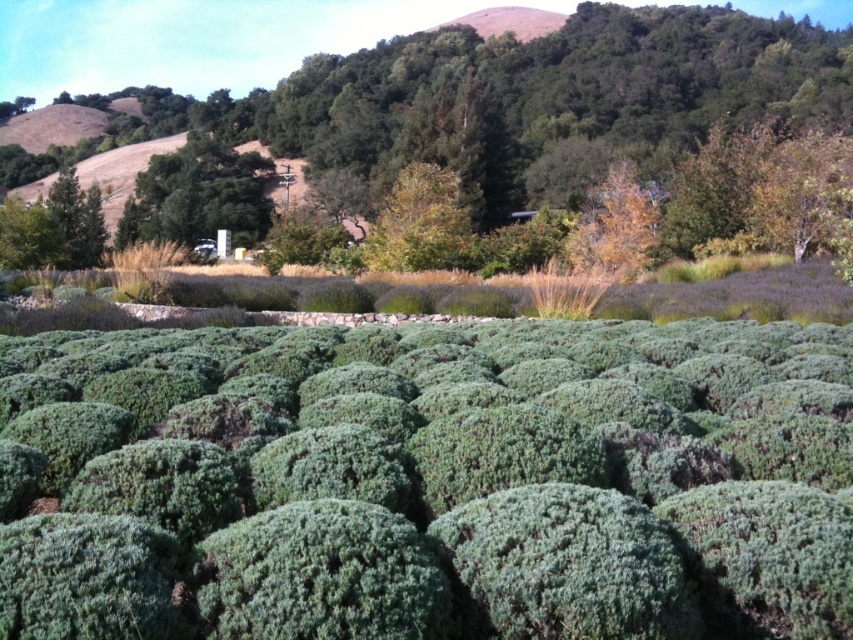
Between green leafy tree at center and green leafy tree at upper center, which one appears on the left side from the viewer's perspective?

Positioned to the left is green leafy tree at upper center.

Looking at this image, who is positioned more to the right, green leafy tree at center or green leafy tree at upper center?

green leafy tree at center is more to the right.

Locate an element on the screen. This screenshot has width=853, height=640. green leafy tree at center is located at coordinates (532, 99).

Find the location of a particular element. This screenshot has height=640, width=853. green leafy tree at center is located at coordinates (532, 99).